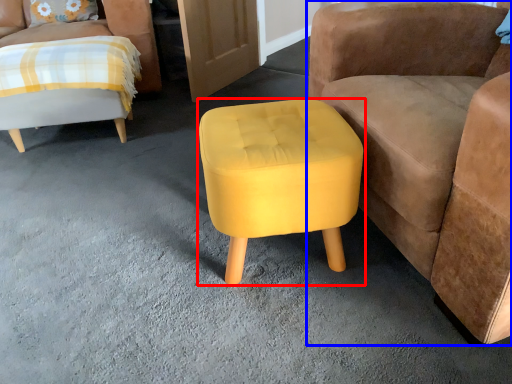
Question: Which object appears closest to the camera in this image, stool (highlighted by a red box) or chair (highlighted by a blue box)?

Choices:
 (A) stool
 (B) chair

Answer: (B)